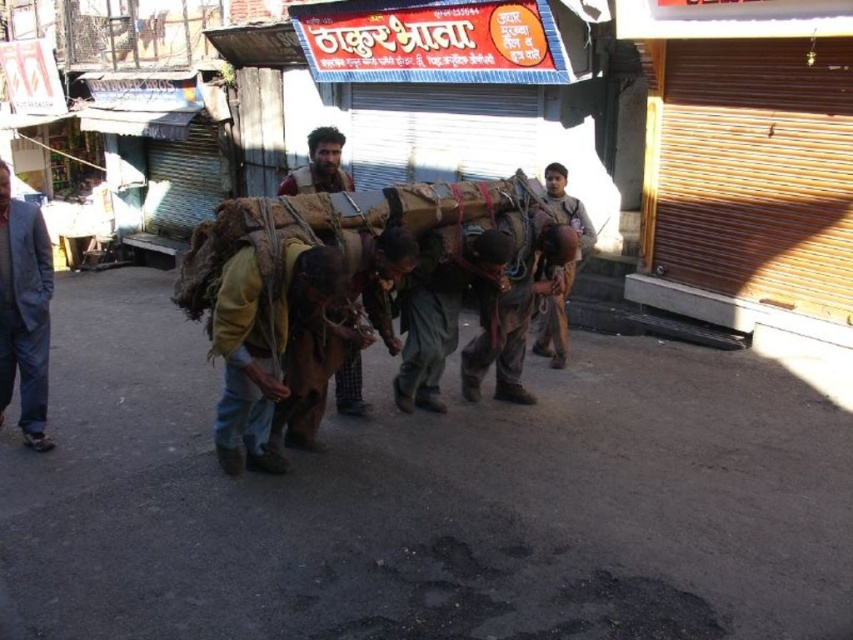
Does point (259, 298) come in front of point (347, 380)?

Yes, point (259, 298) is closer to viewer.

Which is in front, point (270, 349) or point (345, 179)?

Positioned in front is point (270, 349).

Does point (291, 300) come closer to viewer compared to point (350, 184)?

Yes, it is in front of point (350, 184).

The height and width of the screenshot is (640, 853). Find the location of `brown leather jacket at center`. brown leather jacket at center is located at coordinates (263, 342).

Is brown leather jacket at center positioned before light blue fabric jacket at left?

Yes, it is.

Which is in front, point (231, 401) or point (19, 218)?

Point (231, 401)

At what (x,y) coordinates should I click in order to perform the action: click on brown leather jacket at center. Please return your answer as a coordinate pair (x, y). Looking at the image, I should click on (263, 342).

Who is higher up, light blue fabric jacket at left or brown leather bag at center?

Positioned higher is brown leather bag at center.

Which is behind, point (45, 320) or point (544, 321)?

Positioned behind is point (544, 321).

Find the location of a particular element. This screenshot has width=853, height=640. light blue fabric jacket at left is located at coordinates (24, 310).